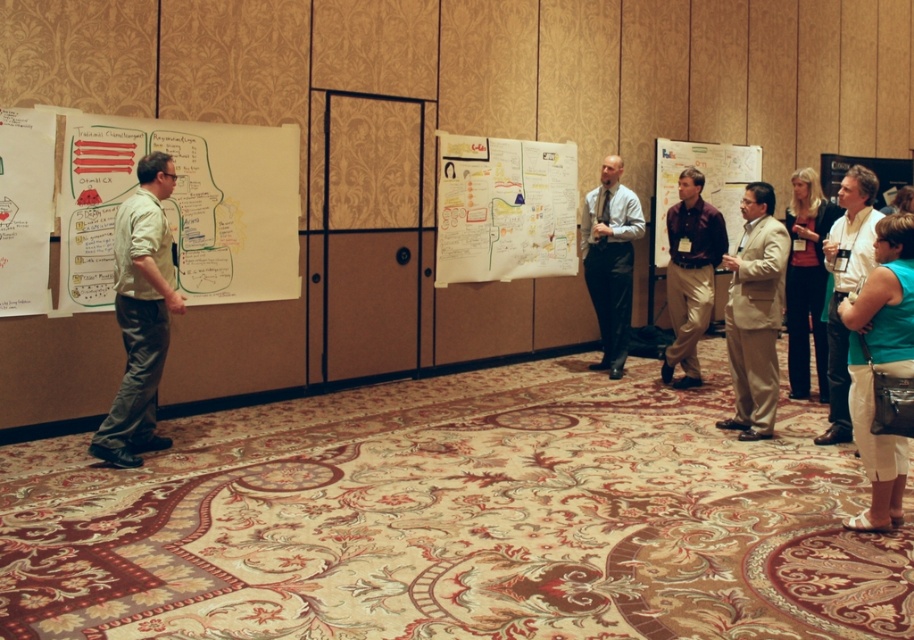
Is point (274, 198) positioned after point (757, 410)?

Yes, it is behind point (757, 410).

You are a GUI agent. You are given a task and a screenshot of the screen. Output one action in this format:
    pyautogui.click(x=<x>, y=<y>)
    Task: Click on the whiteboard with marker drawings at left
    This screenshot has width=914, height=640.
    Given the screenshot: What is the action you would take?
    pyautogui.click(x=184, y=205)

Does point (447, 168) come in front of point (771, 317)?

No, (447, 168) is behind (771, 317).

Can you confirm if yellow paper poster at center is positioned below tan fabric suit at center?

Actually, yellow paper poster at center is above tan fabric suit at center.

Image resolution: width=914 pixels, height=640 pixels. In order to click on yellow paper poster at center in this screenshot , I will do `click(505, 209)`.

At what (x,y) coordinates should I click in order to perform the action: click on white paper at left. Please return your answer as a coordinate pair (x, y). The width and height of the screenshot is (914, 640). Looking at the image, I should click on (25, 209).

Is white paper at left below matte gray suit at center?

Incorrect, white paper at left is not positioned below matte gray suit at center.

Who is more forward, [46,305] or [607,362]?

Point [46,305] is in front.

This screenshot has height=640, width=914. In order to click on white paper at left in this screenshot , I will do `click(25, 209)`.